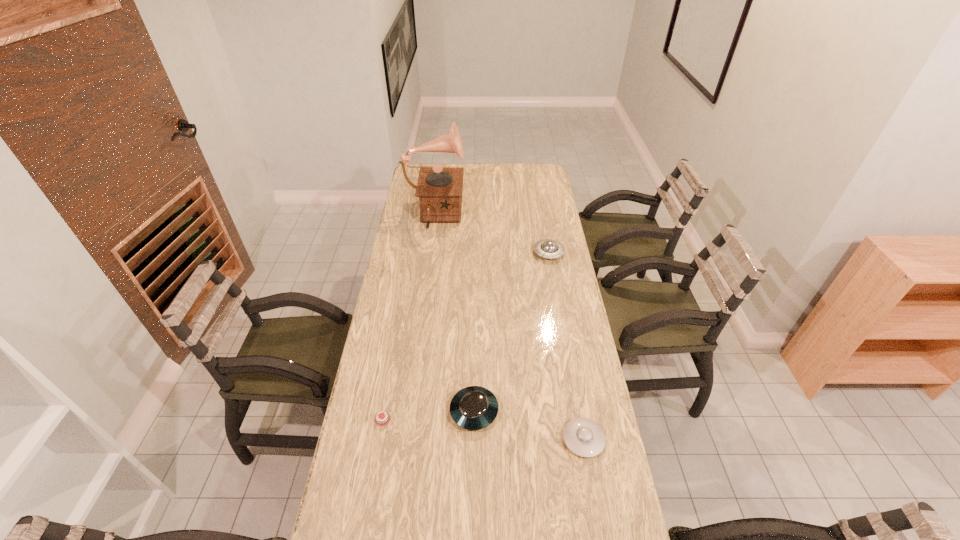
Image resolution: width=960 pixels, height=540 pixels. I want to click on record player, so click(x=439, y=189).

I want to click on the tallest object, so click(439, 189).

Image resolution: width=960 pixels, height=540 pixels. What are the coordinates of `the farthest saucer` in the screenshot? It's located at (547, 248).

This screenshot has height=540, width=960. I want to click on the leftmost saucer, so click(x=473, y=408).

At what (x,y) coordinates should I click in order to perform the action: click on the second shortest object. Please return your answer as a coordinate pair (x, y). The width and height of the screenshot is (960, 540). Looking at the image, I should click on (584, 437).

Locate an element on the screen. the shortest object is located at coordinates (382, 419).

The height and width of the screenshot is (540, 960). Find the location of `vacant space located 0.250m on the horn of the record player`. vacant space located 0.250m on the horn of the record player is located at coordinates (516, 217).

Where is `free space located 0.190m on the back of the fourth nearest object`? This screenshot has width=960, height=540. free space located 0.190m on the back of the fourth nearest object is located at coordinates (542, 219).

Where is `vacant space positioned 0.210m on the right of the leftmost saucer`? The image size is (960, 540). vacant space positioned 0.210m on the right of the leftmost saucer is located at coordinates (564, 411).

Where is `vacant area situated 0.120m on the back of the fourth tallest object`? This screenshot has width=960, height=540. vacant area situated 0.120m on the back of the fourth tallest object is located at coordinates (574, 387).